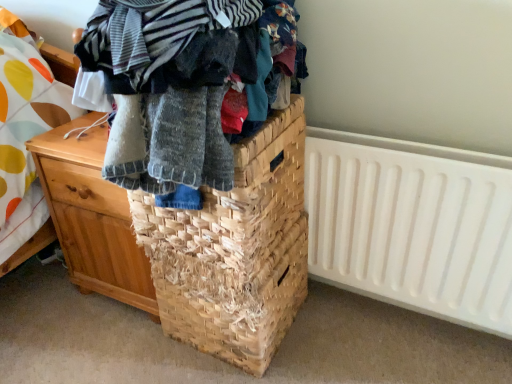
Question: Should I look upward or downward to see natural fiber basket at center?

Choices:
 (A) down
 (B) up

Answer: (A)

Question: Is wooden chest of drawers at left a part of white plastic radiator at right?

Choices:
 (A) yes
 (B) no

Answer: (B)

Question: Can you confirm if white plastic radiator at right is positioned to the left of wooden chest of drawers at left?

Choices:
 (A) no
 (B) yes

Answer: (A)

Question: From the image's perspective, is white plastic radiator at right below wooden chest of drawers at left?

Choices:
 (A) yes
 (B) no

Answer: (A)

Question: Is the position of white plastic radiator at right less distant than that of wooden chest of drawers at left?

Choices:
 (A) no
 (B) yes

Answer: (B)

Question: Is white plastic radiator at right oriented towards wooden chest of drawers at left?

Choices:
 (A) no
 (B) yes

Answer: (A)

Question: Is white plastic radiator at right smaller than wooden chest of drawers at left?

Choices:
 (A) yes
 (B) no

Answer: (A)

Question: Is wooden chest of drawers at left outside knitted wool sweater at center?

Choices:
 (A) no
 (B) yes

Answer: (B)

Question: From the image's perspective, does wooden chest of drawers at left appear higher than knitted wool sweater at center?

Choices:
 (A) no
 (B) yes

Answer: (A)

Question: From a real-world perspective, does wooden chest of drawers at left sit lower than knitted wool sweater at center?

Choices:
 (A) no
 (B) yes

Answer: (B)

Question: Considering the relative sizes of wooden chest of drawers at left and knitted wool sweater at center in the image provided, is wooden chest of drawers at left shorter than knitted wool sweater at center?

Choices:
 (A) no
 (B) yes

Answer: (A)

Question: Does wooden chest of drawers at left contain knitted wool sweater at center?

Choices:
 (A) yes
 (B) no

Answer: (B)

Question: Does wooden chest of drawers at left come in front of knitted wool sweater at center?

Choices:
 (A) yes
 (B) no

Answer: (B)

Question: Can you confirm if natural fiber basket at center is bigger than white plastic radiator at right?

Choices:
 (A) no
 (B) yes

Answer: (B)